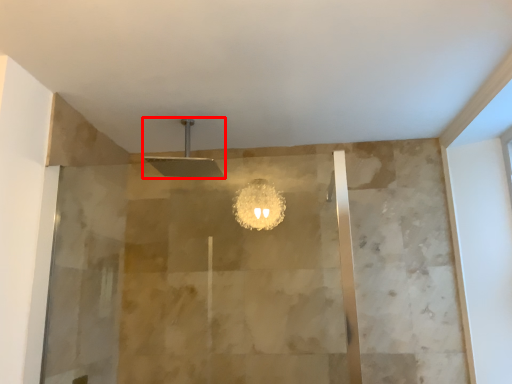
Question: Where is shower (annotated by the red box) located in relation to screen door in the image?

Choices:
 (A) left
 (B) right

Answer: (B)